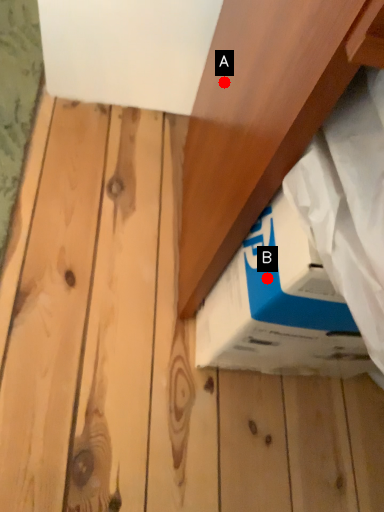
Question: Two points are circled on the image, labeled by A and B beside each circle. Among these points, which one is nearest to the camera?

Choices:
 (A) A is closer
 (B) B is closer

Answer: (B)